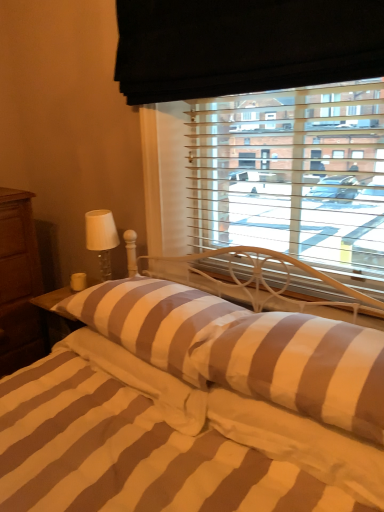
Question: Should I look upward or downward to see brown striped pillow at center, the 1th pillow in the left-to-right sequence?

Choices:
 (A) down
 (B) up

Answer: (A)

Question: Does brown striped pillow at center, positioned as the second pillow in left-to-right order, contain white glass table lamp at left?

Choices:
 (A) yes
 (B) no

Answer: (B)

Question: Is brown striped pillow at center, positioned as the second pillow in left-to-right order, taller than white glass table lamp at left?

Choices:
 (A) no
 (B) yes

Answer: (A)

Question: Can you confirm if brown striped pillow at center, positioned as the 1th pillow in right-to-left order, is positioned to the right of white glass table lamp at left?

Choices:
 (A) no
 (B) yes

Answer: (B)

Question: Considering the relative sizes of brown striped pillow at center, positioned as the second pillow in left-to-right order, and white glass table lamp at left in the image provided, is brown striped pillow at center, positioned as the second pillow in left-to-right order, shorter than white glass table lamp at left?

Choices:
 (A) no
 (B) yes

Answer: (B)

Question: Can you confirm if brown striped pillow at center, positioned as the 1th pillow in right-to-left order, is thinner than white glass table lamp at left?

Choices:
 (A) no
 (B) yes

Answer: (A)

Question: From the image's perspective, is brown striped pillow at center, positioned as the second pillow in left-to-right order, on top of white glass table lamp at left?

Choices:
 (A) yes
 (B) no

Answer: (B)

Question: From the image's perspective, would you say brown wood nightstand at left is shown under brown striped pillow at center, positioned as the second pillow in left-to-right order?

Choices:
 (A) no
 (B) yes

Answer: (A)

Question: Is brown wood nightstand at left completely or partially outside of brown striped pillow at center, positioned as the 1th pillow in right-to-left order?

Choices:
 (A) no
 (B) yes

Answer: (B)

Question: Is brown wood nightstand at left at the left side of brown striped pillow at center, positioned as the 1th pillow in right-to-left order?

Choices:
 (A) no
 (B) yes

Answer: (B)

Question: Is brown wood nightstand at left positioned behind brown striped pillow at center, positioned as the second pillow in left-to-right order?

Choices:
 (A) yes
 (B) no

Answer: (A)

Question: Is brown wood nightstand at left smaller than brown striped pillow at center, positioned as the second pillow in left-to-right order?

Choices:
 (A) no
 (B) yes

Answer: (A)

Question: Is brown wood nightstand at left positioned with its back to brown striped pillow at center, positioned as the second pillow in left-to-right order?

Choices:
 (A) yes
 (B) no

Answer: (B)

Question: Is brown striped pillow at center, positioned as the second pillow in left-to-right order, surrounding striped fabric bed at center?

Choices:
 (A) yes
 (B) no

Answer: (B)